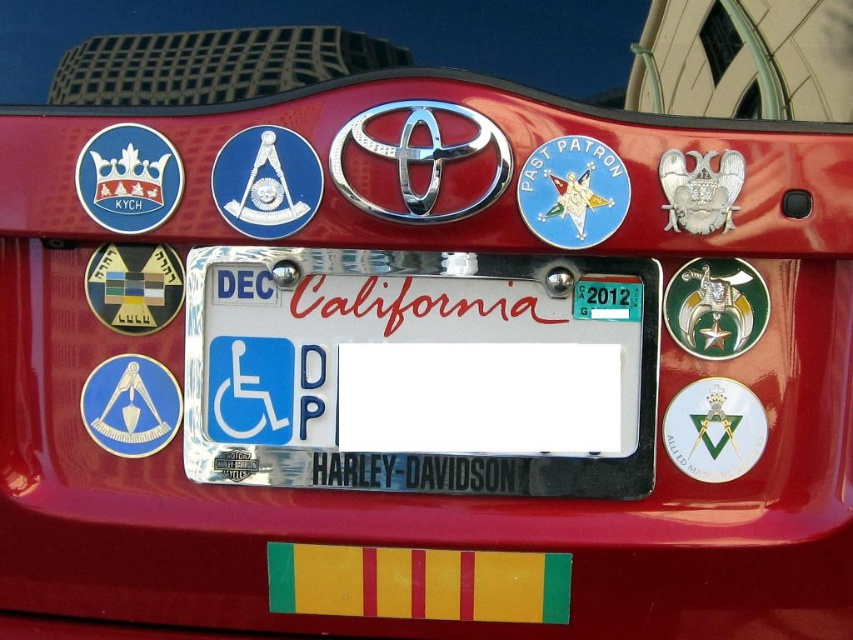
Question: Which of the following is the closest to the observer?

Choices:
 (A) white glossy emblem at center
 (B) shiny metallic badge at center
 (C) green plastic sticker at center

Answer: (B)

Question: Can you confirm if shiny metallic badge at center is positioned above white glossy emblem at center?

Choices:
 (A) yes
 (B) no

Answer: (A)

Question: Can you confirm if shiny metallic badge at center is positioned below blue glossy masonic symbol at lower left?

Choices:
 (A) no
 (B) yes

Answer: (A)

Question: Which is farther from the white glossy emblem at center?

Choices:
 (A) white plastic license plate at center
 (B) shiny metallic badge at center
 (C) green plastic sticker at center

Answer: (B)

Question: Among these points, which one is farthest from the camera?

Choices:
 (A) (618, 282)
 (B) (495, 384)
 (C) (155, 362)
 (D) (698, 468)

Answer: (C)

Question: Does shiny metallic badge at center have a lesser width compared to green plastic sticker at center?

Choices:
 (A) no
 (B) yes

Answer: (A)